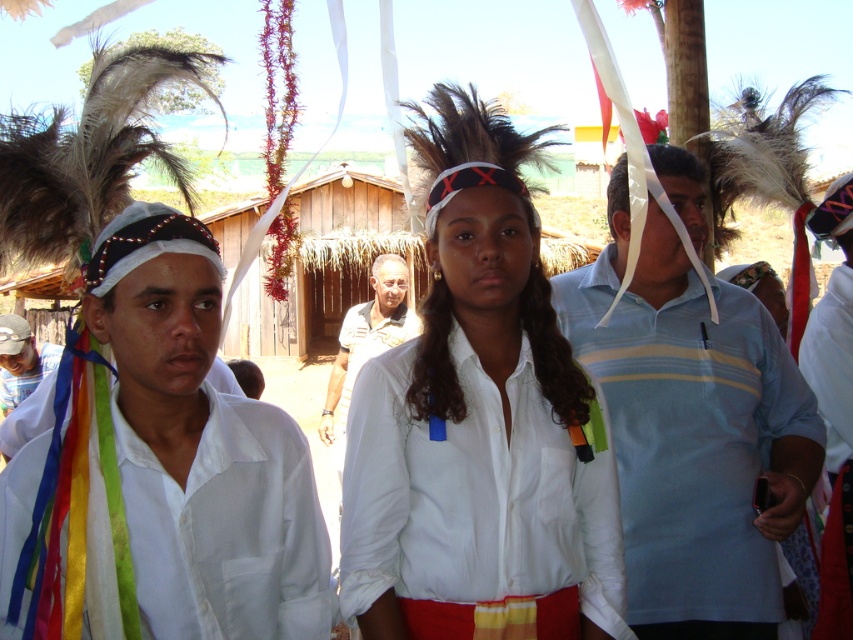
Consider the image. Which is above, white matte headdress at left or black fabric shirt at center?

black fabric shirt at center

Is point (190, 292) farther from viewer compared to point (373, 348)?

No, it is not.

Measure the distance between white matte headdress at left and camera.

white matte headdress at left is 2.13 meters from camera.

The image size is (853, 640). What are the coordinates of `white matte headdress at left` in the screenshot? It's located at (227, 525).

Is light blue striped polo shirt at center wider than white fabric at left?

Yes.

Between light blue striped polo shirt at center and white fabric at left, which one appears on the left side from the viewer's perspective?

Positioned to the left is white fabric at left.

You are a GUI agent. You are given a task and a screenshot of the screen. Output one action in this format:
    pyautogui.click(x=<x>, y=<y>)
    Task: Click on the light blue striped polo shirt at center
    The height and width of the screenshot is (640, 853).
    Given the screenshot: What is the action you would take?
    pyautogui.click(x=692, y=432)

Where is `light blue striped polo shirt at center`? This screenshot has height=640, width=853. light blue striped polo shirt at center is located at coordinates [692, 432].

Can you confirm if white matte shirt at center is wider than light blue striped polo shirt at center?

In fact, white matte shirt at center might be narrower than light blue striped polo shirt at center.

Does white matte shirt at center appear over light blue striped polo shirt at center?

Yes.

Does point (491, 506) lie in front of point (659, 212)?

Yes, point (491, 506) is in front of point (659, 212).

You are a GUI agent. You are given a task and a screenshot of the screen. Output one action in this format:
    pyautogui.click(x=<x>, y=<y>)
    Task: Click on the white matte shirt at center
    Image resolution: width=853 pixels, height=640 pixels.
    Given the screenshot: What is the action you would take?
    pyautogui.click(x=479, y=426)